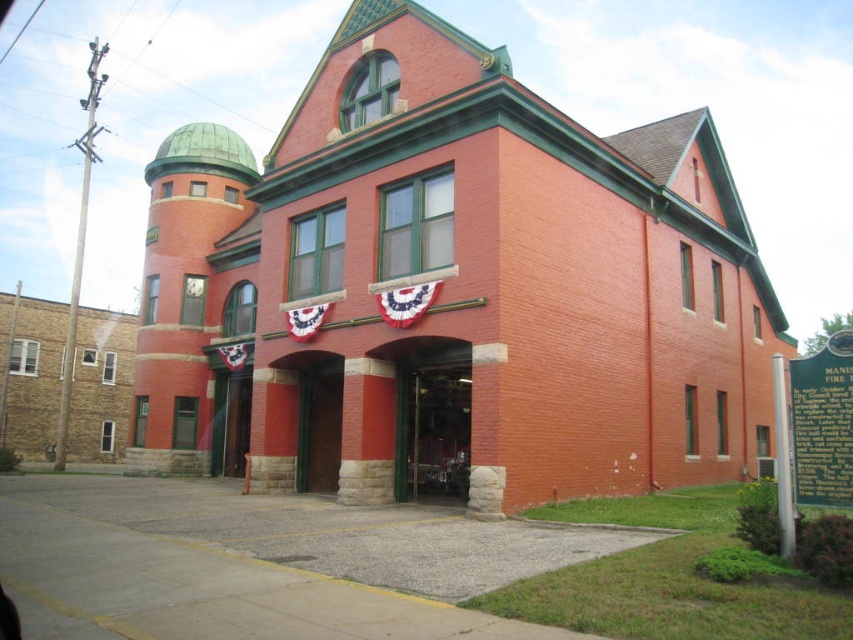
Question: Is metallic glass door at center positioned before green wooden door at center?

Choices:
 (A) no
 (B) yes

Answer: (B)

Question: Which point is closer to the camera?

Choices:
 (A) metallic glass door at center
 (B) green wooden door at center

Answer: (A)

Question: Is metallic glass door at center smaller than green wooden door at center?

Choices:
 (A) no
 (B) yes

Answer: (A)

Question: Does metallic glass door at center appear under green wooden door at center?

Choices:
 (A) yes
 (B) no

Answer: (B)

Question: Among these objects, which one is farthest from the camera?

Choices:
 (A) metallic glass door at center
 (B) green wooden door at center

Answer: (B)